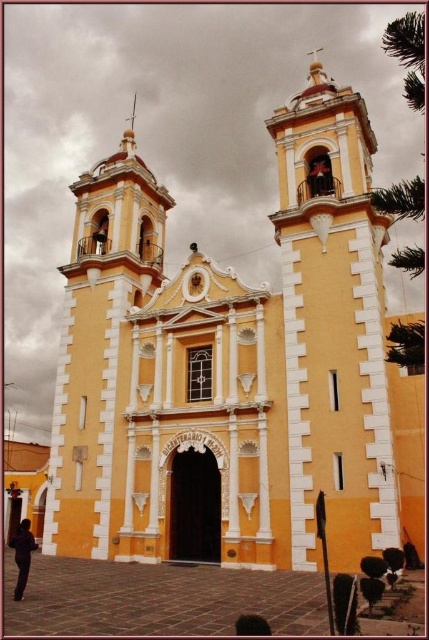
Who is more forward, (186, 282) or (12, 538)?

Positioned in front is point (186, 282).

Image resolution: width=429 pixels, height=640 pixels. Describe the element at coordinates (236, 364) in the screenshot. I see `yellow matte church at center` at that location.

Locate an element on the screen. This screenshot has width=429, height=640. yellow matte church at center is located at coordinates (236, 364).

Can you confirm if yellow matte church at center is positioned below smooth orange bell tower at right?

Indeed, yellow matte church at center is positioned under smooth orange bell tower at right.

Is point (100, 449) closer to camera compared to point (335, 416)?

No, (100, 449) is behind (335, 416).

Locate an element on the screen. yellow matte church at center is located at coordinates (236, 364).

Between point (287, 196) and point (21, 582), which one is positioned in front?

Point (21, 582)

Is smooth orange bell tower at right further to the viewer compared to dark brown leather jacket at lower left?

Yes, it is behind dark brown leather jacket at lower left.

Who is more forward, (332, 163) or (18, 600)?

Point (18, 600)

Where is `smooth orange bell tower at right`? smooth orange bell tower at right is located at coordinates (332, 324).